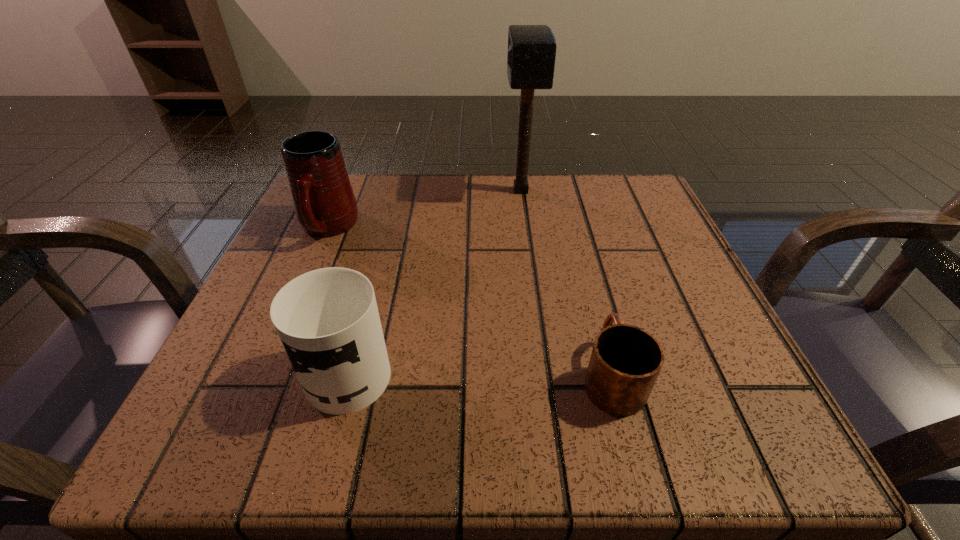
This screenshot has width=960, height=540. Find the location of `free space that satisfies the following two spatial constraints: 1. on the handle side of the tallest object; 2. on the left side of the second object from left to right`. free space that satisfies the following two spatial constraints: 1. on the handle side of the tallest object; 2. on the left side of the second object from left to right is located at coordinates (397, 191).

What are the coordinates of `free location that satisfies the following two spatial constraints: 1. on the handle side of the mallet; 2. on the right side of the second mug from right to left` in the screenshot? It's located at (397, 191).